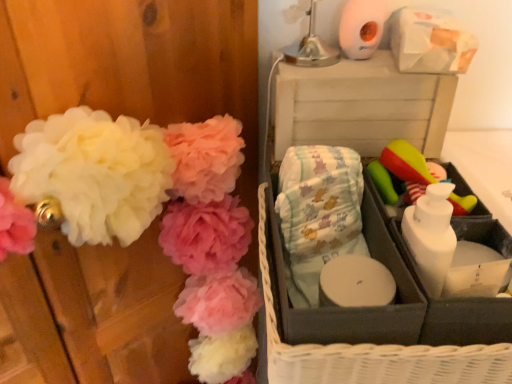
I want to click on vacant point to the left of white matte toilet paper at upper right, so click(302, 58).